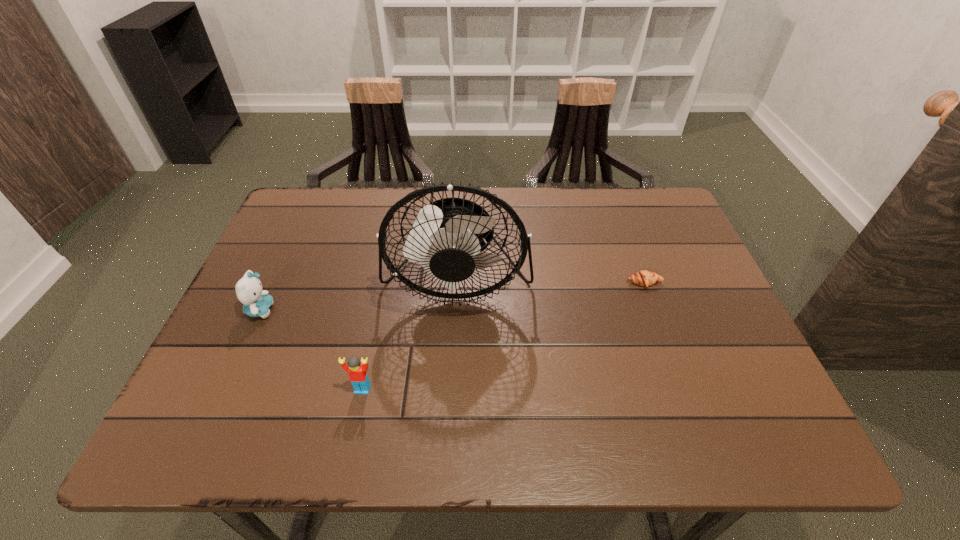
The height and width of the screenshot is (540, 960). Find the location of `free space that is in between the leftmost object and the fan`. free space that is in between the leftmost object and the fan is located at coordinates (359, 294).

Find the location of a particular element. The image size is (960, 540). vacant region between the kitten and the Lego is located at coordinates (311, 349).

The image size is (960, 540). Identify the location of vacant area that lies between the pastry and the tallest object. (551, 281).

Find the location of a particular element. object identified as the third closest to the leftmost object is located at coordinates (644, 278).

This screenshot has height=540, width=960. What are the coordinates of `object that stands as the closest to the nearest object` in the screenshot? It's located at (447, 239).

This screenshot has width=960, height=540. I want to click on free space that satisfies the following two spatial constraints: 1. on the front-facing side of the shortest object; 2. on the face of the leftmost object, so click(x=654, y=310).

Identify the location of free space that satisfies the following two spatial constraints: 1. in front of the tallest object, directing airflow; 2. on the face of the leftmost object. (456, 310).

Where is `free spot that satisfies the following two spatial constraints: 1. in front of the tallest object, directing airflow; 2. on the face of the leftmost object`? This screenshot has height=540, width=960. free spot that satisfies the following two spatial constraints: 1. in front of the tallest object, directing airflow; 2. on the face of the leftmost object is located at coordinates (456, 310).

I want to click on vacant region that satisfies the following two spatial constraints: 1. on the front-facing side of the shortest object; 2. on the face of the kitten, so 654,310.